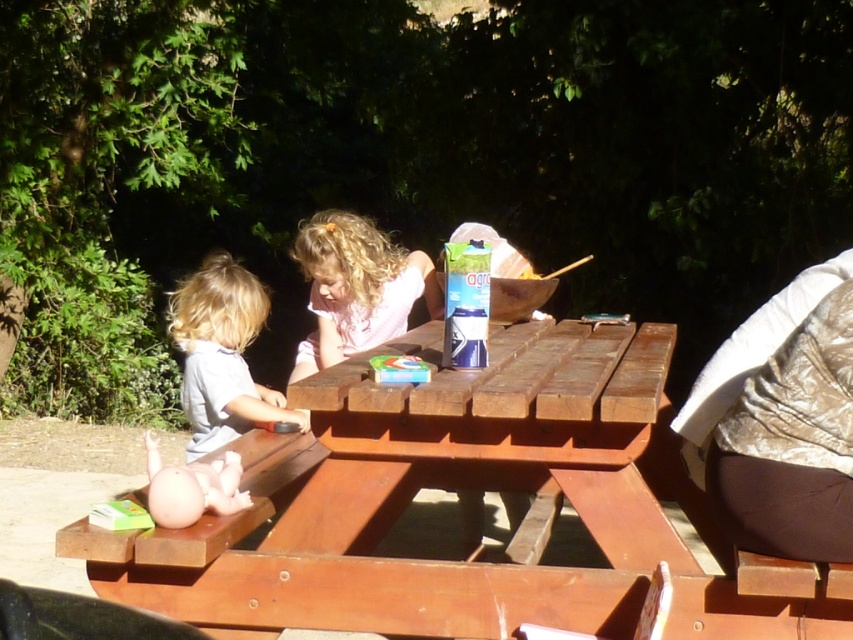
Question: Is blonde hair girl at center positioned in front of smooth gray shirt at left?

Choices:
 (A) no
 (B) yes

Answer: (A)

Question: Which point is closer to the camera taking this photo?

Choices:
 (A) (358, 256)
 (B) (241, 376)

Answer: (B)

Question: Which of the following is the farthest from the observer?

Choices:
 (A) wooden picnic table at center
 (B) blonde hair girl at center

Answer: (B)

Question: Is blonde hair girl at center smaller than smooth gray shirt at left?

Choices:
 (A) no
 (B) yes

Answer: (B)

Question: Is wooden picnic table at center positioned in front of blonde hair girl at center?

Choices:
 (A) yes
 (B) no

Answer: (A)

Question: Which point is closer to the camera?

Choices:
 (A) (521, 428)
 (B) (306, 355)

Answer: (A)